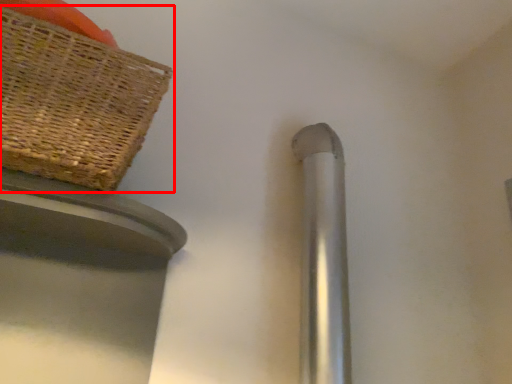
Question: From the image, what is the correct spatial relationship of picnic basket (annotated by the red box) in relation to door handle?

Choices:
 (A) left
 (B) right

Answer: (A)